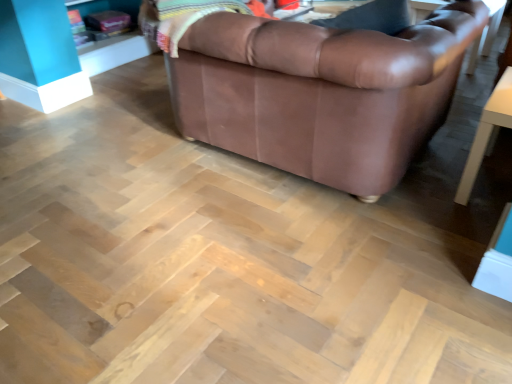
Question: From the image's perspective, is brown leather couch at upper center on top of white glossy table at lower right?

Choices:
 (A) yes
 (B) no

Answer: (A)

Question: Does brown leather couch at upper center come in front of white glossy table at lower right?

Choices:
 (A) yes
 (B) no

Answer: (A)

Question: Is brown leather couch at upper center facing away from white glossy table at lower right?

Choices:
 (A) no
 (B) yes

Answer: (A)

Question: From a real-world perspective, is brown leather couch at upper center on top of white glossy table at lower right?

Choices:
 (A) no
 (B) yes

Answer: (B)

Question: Is white glossy table at lower right a part of brown leather couch at upper center?

Choices:
 (A) yes
 (B) no

Answer: (B)

Question: Can you confirm if brown leather couch at upper center is bigger than white glossy table at lower right?

Choices:
 (A) yes
 (B) no

Answer: (A)

Question: Is white glossy table at lower right closer to the viewer compared to brown leather couch at upper center?

Choices:
 (A) no
 (B) yes

Answer: (A)

Question: From the image's perspective, is white glossy table at lower right on top of brown leather couch at upper center?

Choices:
 (A) no
 (B) yes

Answer: (A)

Question: Is white glossy table at lower right completely or partially outside of brown leather couch at upper center?

Choices:
 (A) yes
 (B) no

Answer: (A)

Question: From the image's perspective, is white glossy table at lower right beneath brown leather couch at upper center?

Choices:
 (A) no
 (B) yes

Answer: (B)

Question: Is white glossy table at lower right positioned with its back to brown leather couch at upper center?

Choices:
 (A) yes
 (B) no

Answer: (B)

Question: Does white glossy table at lower right appear on the right side of brown leather couch at upper center?

Choices:
 (A) yes
 (B) no

Answer: (A)

Question: In the image, is white glossy table at lower right positioned in front of or behind brown leather couch at upper center?

Choices:
 (A) behind
 (B) front

Answer: (A)